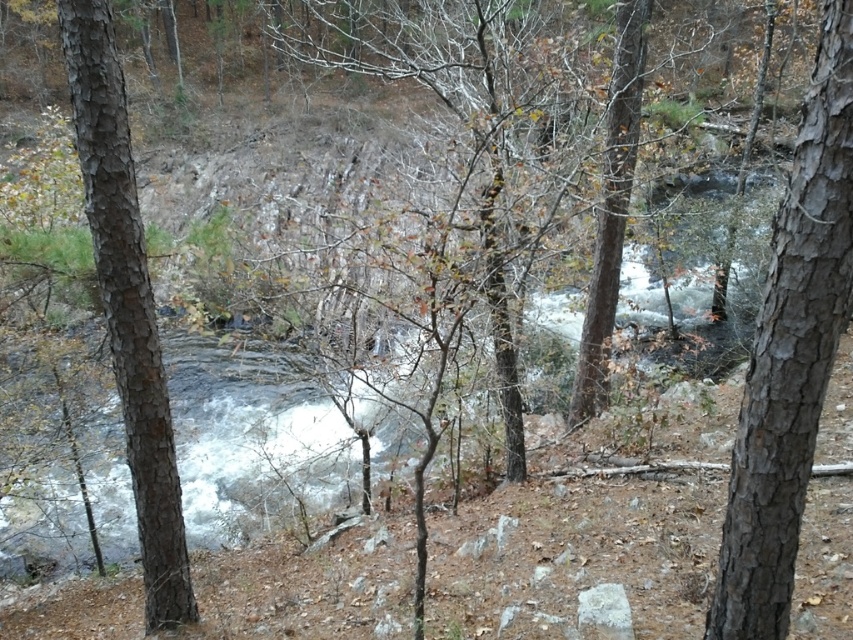
Question: Observing the image, what is the correct spatial positioning of brown bark tree at center in reference to brown rough tree at center?

Choices:
 (A) left
 (B) right

Answer: (A)

Question: Which point is closer to the camera?

Choices:
 (A) (801, 115)
 (B) (596, 339)

Answer: (A)

Question: Which is nearer to the smooth bark tree at right?

Choices:
 (A) brown bark tree at center
 (B) smooth bark tree at left
 (C) brown rough tree at center

Answer: (B)

Question: Among these points, which one is nearest to the camera?

Choices:
 (A) (775, 547)
 (B) (494, 307)

Answer: (A)

Question: Does smooth bark tree at right appear under brown rough tree at center?

Choices:
 (A) no
 (B) yes

Answer: (B)

Question: Is smooth bark tree at left wider than brown rough tree at center?

Choices:
 (A) yes
 (B) no

Answer: (B)